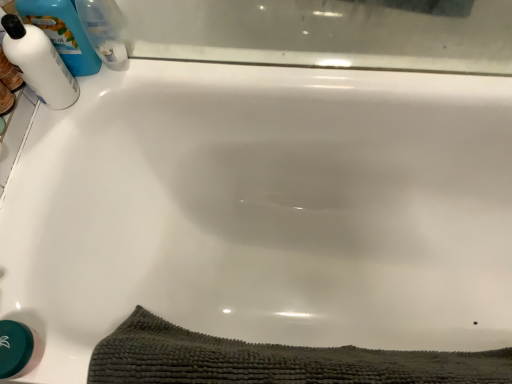
I want to click on free spot to the right of white glossy bottle at upper left, which is the 3th cleaning product in right-to-left order, so click(x=120, y=79).